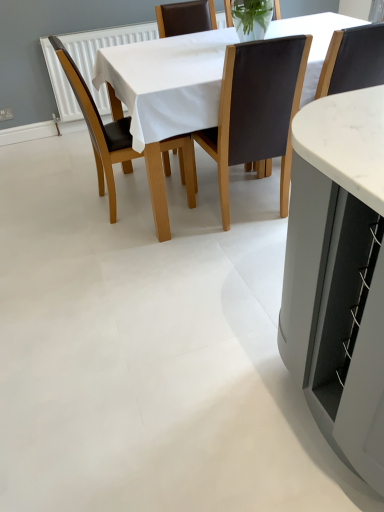
Locate an element on the screen. The width and height of the screenshot is (384, 512). free space in front of brown leather chair at center, arranged as the 1th chair when viewed from the left is located at coordinates (129, 241).